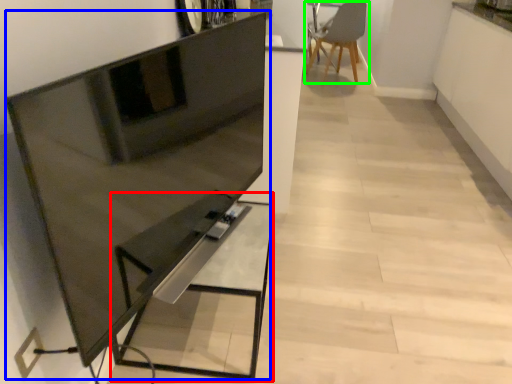
Question: Which is farther away from table (highlighted by a red box)? entertainment center (highlighted by a blue box) or chair (highlighted by a green box)?

Choices:
 (A) entertainment center
 (B) chair

Answer: (B)